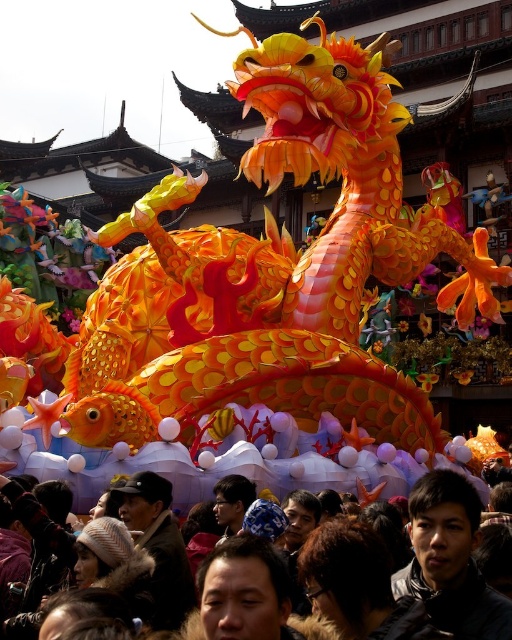
Question: Which point is closer to the camera?

Choices:
 (A) matte black jacket at lower right
 (B) dark brown fur coat at lower center

Answer: (B)

Question: Which object is farther from the camera taking this photo?

Choices:
 (A) dark brown fur coat at lower center
 (B) matte black jacket at lower right

Answer: (B)

Question: Considering the relative positions of dark brown fur coat at lower center and matte black jacket at lower right in the image provided, where is dark brown fur coat at lower center located with respect to matte black jacket at lower right?

Choices:
 (A) left
 (B) right

Answer: (A)

Question: Does dark brown fur coat at lower center lie behind matte black jacket at lower right?

Choices:
 (A) no
 (B) yes

Answer: (A)

Question: Is dark brown fur coat at lower center smaller than matte black jacket at lower right?

Choices:
 (A) yes
 (B) no

Answer: (B)